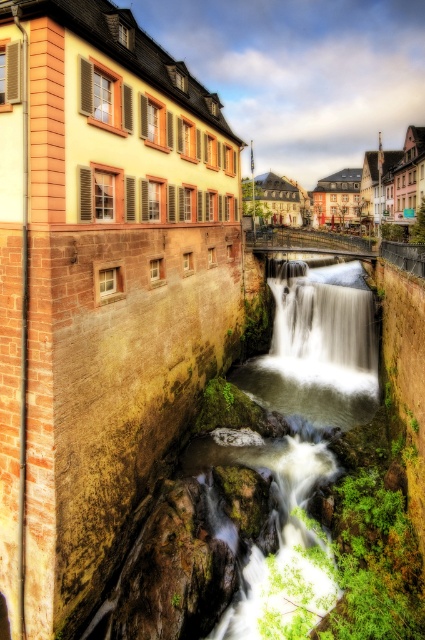
Is pastel painted buildings at center smaller than white frothy water at center?

No, pastel painted buildings at center is not smaller than white frothy water at center.

Is pastel painted buildings at center to the left of white frothy water at center from the viewer's perspective?

In fact, pastel painted buildings at center is to the right of white frothy water at center.

Who is more forward, (260, 200) or (277, 312)?

Positioned in front is point (277, 312).

The image size is (425, 640). Find the location of `pastel painted buildings at center`. pastel painted buildings at center is located at coordinates (350, 192).